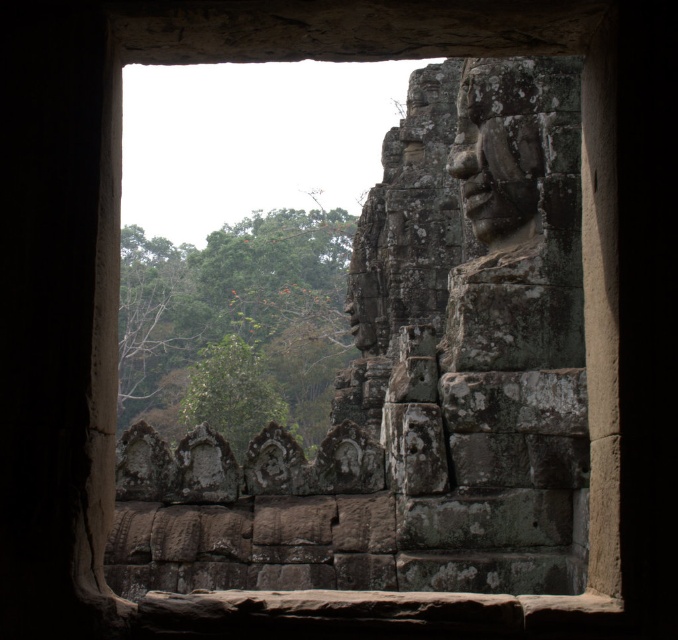
Can you confirm if green leafy tree at left is thinner than rough stone face at upper right?

In fact, green leafy tree at left might be wider than rough stone face at upper right.

Who is more forward, (325,320) or (527,216)?

Point (527,216) is in front.

Where is `green leafy tree at left`? green leafy tree at left is located at coordinates 235,324.